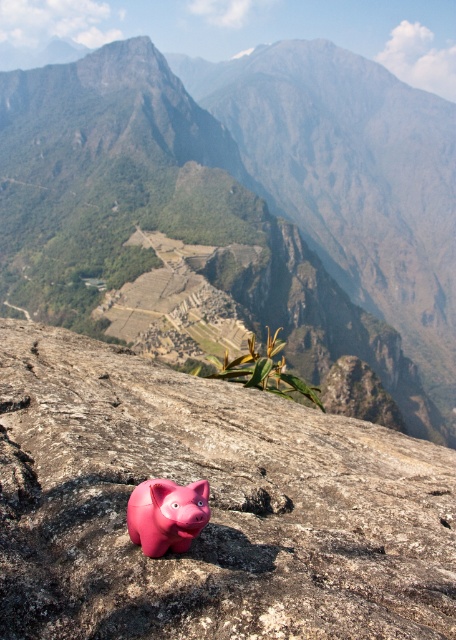
Based on the photo, is the position of pink matte piggy bank at center less distant than that of pink rubber piggy bank at center?

That is True.

This screenshot has width=456, height=640. Find the location of `pink matte piggy bank at center`. pink matte piggy bank at center is located at coordinates (211, 506).

Who is positioned more to the left, matte gray rock at center or pink rubber piggy bank at center?

Positioned to the left is pink rubber piggy bank at center.

Between point (440, 218) and point (171, 513), which one is positioned in front?

Point (171, 513)

The width and height of the screenshot is (456, 640). Identify the location of matte gray rock at center. (242, 205).

The image size is (456, 640). In order to click on matte gray rock at center in this screenshot , I will do `click(242, 205)`.

Does matte gray rock at center appear over pink matte piggy bank at center?

Yes, matte gray rock at center is above pink matte piggy bank at center.

Who is more distant from viewer, (367,218) or (294,461)?

The point (367,218) is behind.

Where is `matte gray rock at center`? The width and height of the screenshot is (456, 640). matte gray rock at center is located at coordinates (242, 205).